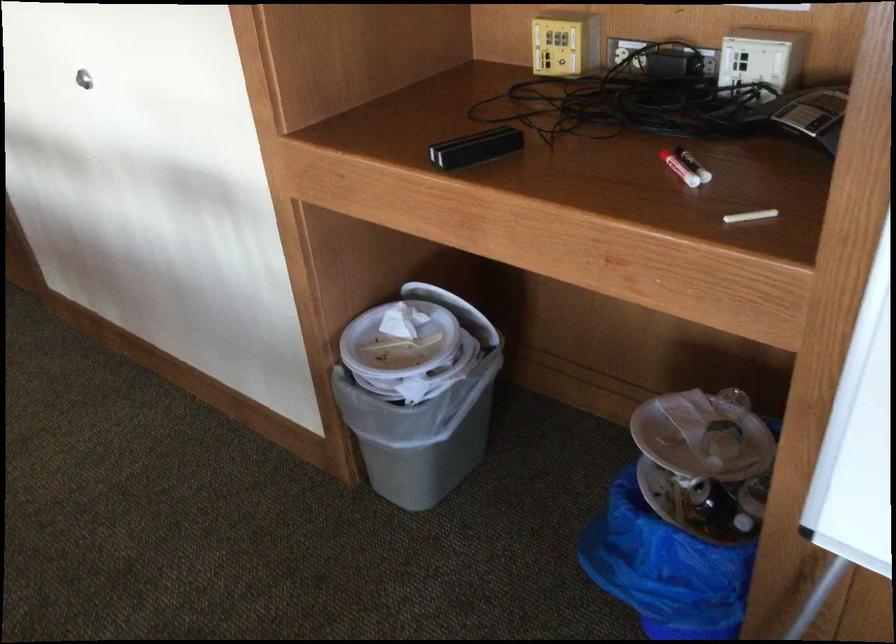
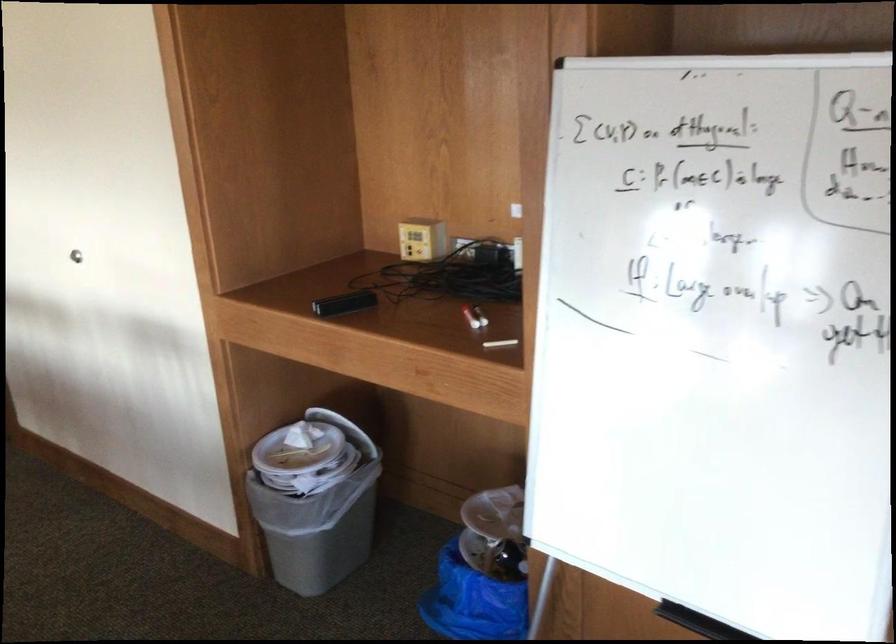
Where in the second image is the point corresponding to (x=432, y=412) from the first image?

(316, 506)